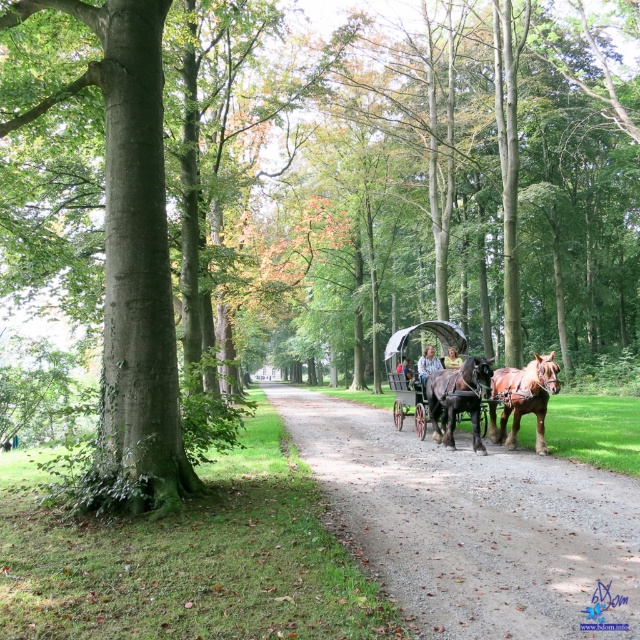
Does brown glossy horse at right have a greater height compared to light brown leather jacket at center?

No.

Is brown glossy horse at right below light brown leather jacket at center?

Indeed, brown glossy horse at right is positioned under light brown leather jacket at center.

Which is in front, point (541, 385) or point (454, 353)?

Point (541, 385)

Where is `brown glossy horse at right`? Image resolution: width=640 pixels, height=640 pixels. brown glossy horse at right is located at coordinates (522, 397).

Based on the photo, who is taller, gravel path at center or light brown leather jacket at center?

With more height is gravel path at center.

Is point (580, 504) positioned after point (460, 356)?

No.

Is point (596, 492) less distant than point (449, 355)?

Yes, point (596, 492) is closer to viewer.

At what (x,y) coordinates should I click in order to perform the action: click on gravel path at center. Please return your answer as a coordinate pair (x, y). Looking at the image, I should click on (472, 522).

Does brown glossy horse at center have a greater width compared to shiny black carriage at center?

Incorrect, brown glossy horse at center's width does not surpass shiny black carriage at center's.

Is brown glossy horse at center behind shiny black carriage at center?

No, brown glossy horse at center is in front of shiny black carriage at center.

Does point (480, 381) lie behind point (394, 353)?

No, (480, 381) is in front of (394, 353).

Find the location of a particular element. This screenshot has width=640, height=640. brown glossy horse at center is located at coordinates (458, 397).